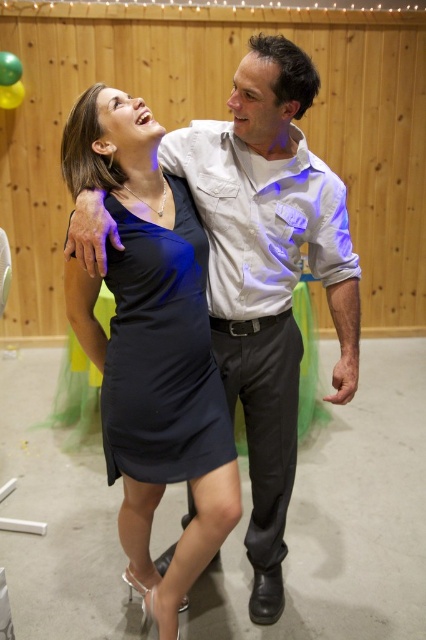
You are standing in the room and see two points marked in the image. Which point is nearer to you, point (x=137, y=406) or point (x=6, y=61)?

Point (x=137, y=406) is closer to the viewer than point (x=6, y=61).

You are a photographer at the event and need to capture a photo where both the black satin dress at center and the yellow rubber balloon at upper left are visible. Considering their sizes, which object might require you to adjust your camera angle to ensure it fits in the frame?

The black satin dress at center might be wider than the yellow rubber balloon at upper left, so you might need to adjust your camera angle to accommodate its width.